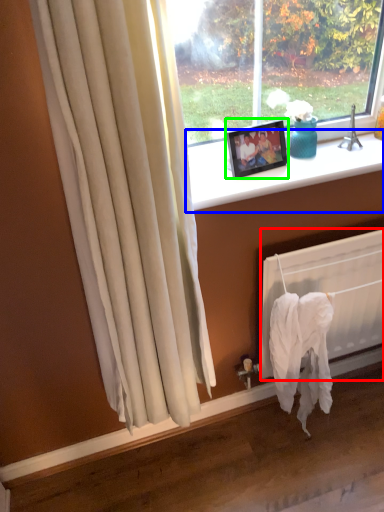
Question: Which object is positioned farthest from radiator (highlighted by a red box)? Select from window sill (highlighted by a blue box) and picture frame (highlighted by a green box).

Choices:
 (A) window sill
 (B) picture frame

Answer: (B)